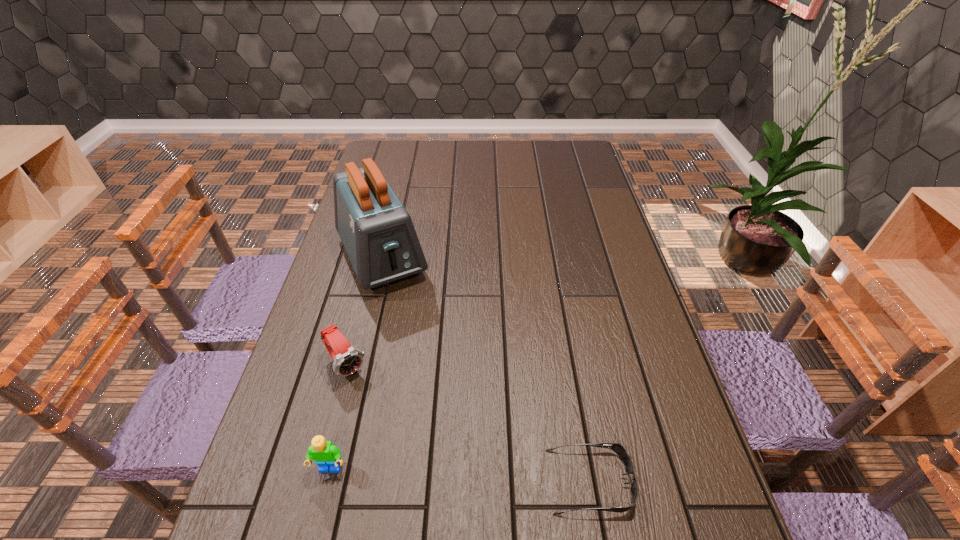
The height and width of the screenshot is (540, 960). What are the coordinates of `Lego` in the screenshot? It's located at (327, 456).

Find the location of a particular element. The height and width of the screenshot is (540, 960). the shortest object is located at coordinates (616, 447).

Find the location of `the rightmost object`. the rightmost object is located at coordinates (616, 447).

The width and height of the screenshot is (960, 540). In order to click on watch in this screenshot , I will do tap(347, 359).

Locate an element on the screen. the tallest object is located at coordinates (377, 232).

Identify the location of toaster. Image resolution: width=960 pixels, height=540 pixels. (377, 232).

Locate an element on the screen. vacant region located 0.050m on the face of the Lego is located at coordinates (323, 504).

The image size is (960, 540). What are the coordinates of `vacant space located 0.100m on the front-facing side of the rightmost object` in the screenshot? It's located at (681, 481).

The image size is (960, 540). Identify the location of blank space located 0.350m on the face of the watch. (445, 501).

Locate an element on the screen. The width and height of the screenshot is (960, 540). vacant space positioned on the face of the watch is located at coordinates (374, 405).